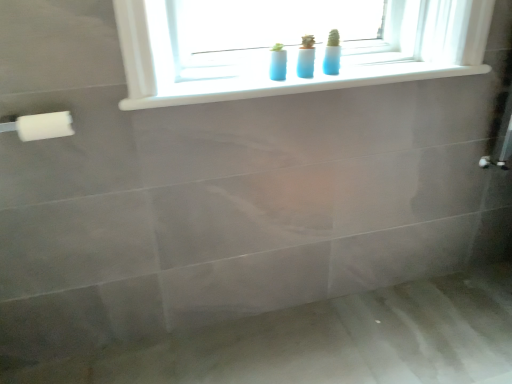
Question: Is white plastic towel bar at left taller or shorter than matte gray bath at lower center?

Choices:
 (A) tall
 (B) short

Answer: (A)

Question: Is point (45, 129) closer or farther from the camera than point (330, 180)?

Choices:
 (A) closer
 (B) farther

Answer: (A)

Question: Estimate the real-world distances between objects in this image. Which object is closer to the white plastic towel bar at left?

Choices:
 (A) white plastic window sill at upper center
 (B) matte gray bath at lower center

Answer: (A)

Question: Based on their relative distances, which object is farther from the matte gray bath at lower center?

Choices:
 (A) white plastic towel bar at left
 (B) white plastic window sill at upper center

Answer: (A)